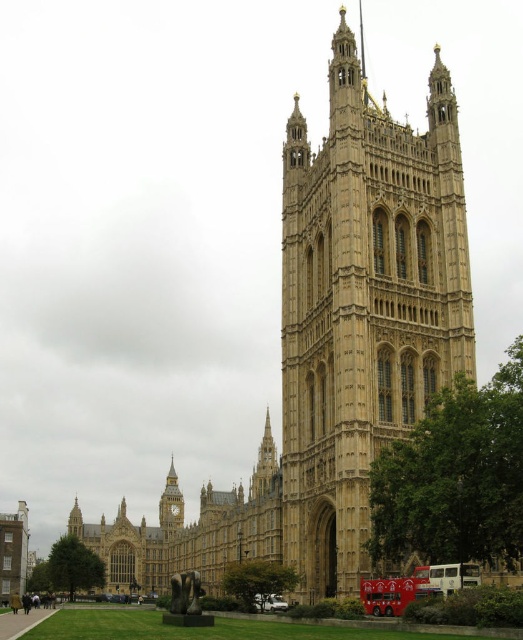
Question: Can you confirm if white metallic bus at lower center is smaller than golden stone clock tower at center?

Choices:
 (A) yes
 (B) no

Answer: (A)

Question: Where is golden stone tower at center located in relation to golden stone clock tower at center in the image?

Choices:
 (A) right
 (B) left

Answer: (A)

Question: Which object is positioned closest to the golden stone tower at center?

Choices:
 (A) white metallic bus at lower center
 (B) golden stone clock tower at center

Answer: (A)

Question: Is golden stone tower at center positioned before golden stone clock tower at center?

Choices:
 (A) no
 (B) yes

Answer: (B)

Question: Which of the following is the farthest from the observer?

Choices:
 (A) (404, 598)
 (B) (162, 515)

Answer: (B)

Question: Which object is positioned farthest from the white metallic bus at lower center?

Choices:
 (A) red painted bus at lower center
 (B) golden stone clock tower at center
 (C) golden stone tower at center

Answer: (B)